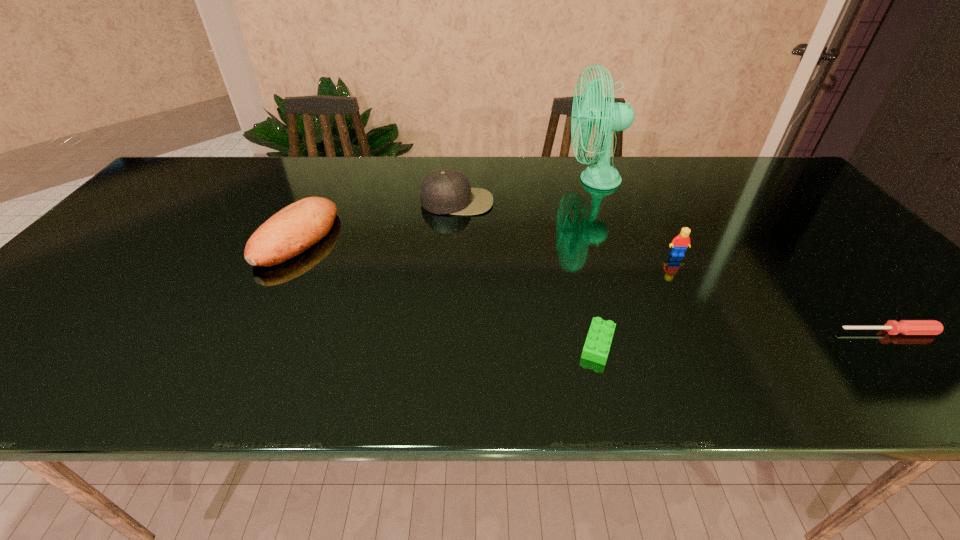
The image size is (960, 540). Identify the location of free space that satisfies the following two spatial constraints: 1. in front of the fan to blow air; 2. on the brim of the fifth object from right to left. (603, 202).